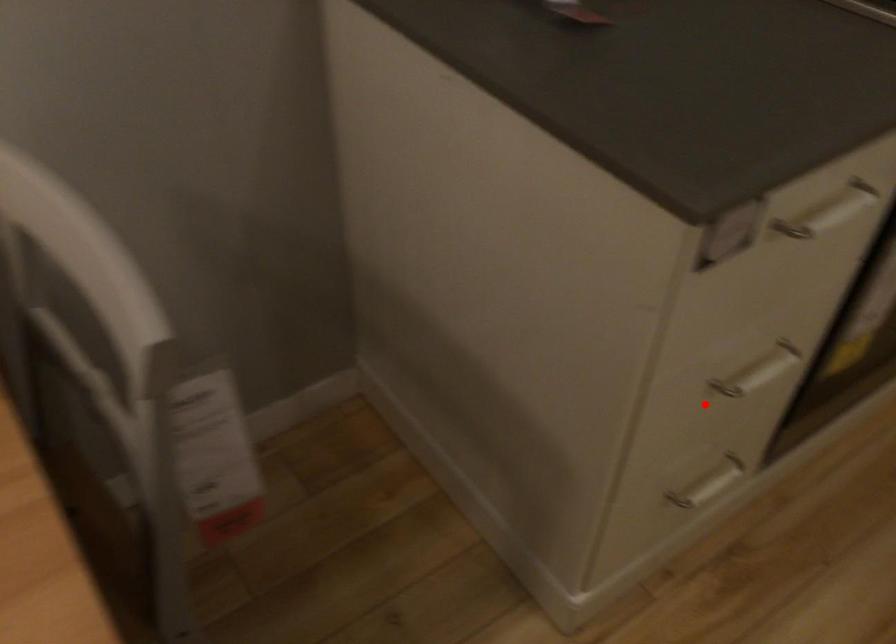
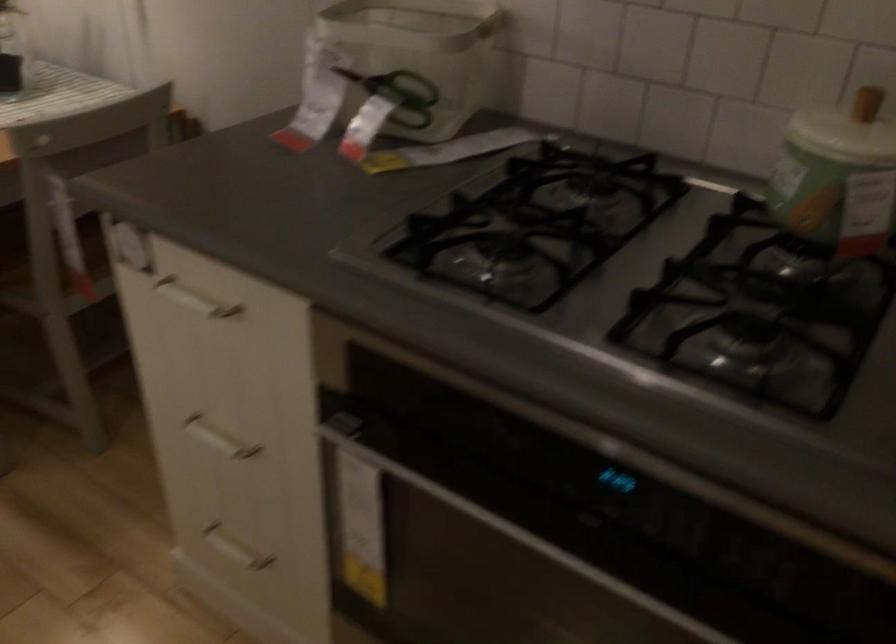
Question: I am providing you with two images of the same scene from different viewpoints. Image1 has a red point marked. In image2, the corresponding 3D location appears at what relative position? Reply with the corresponding letter.

Choices:
 (A) Closer
 (B) Farther

Answer: (B)